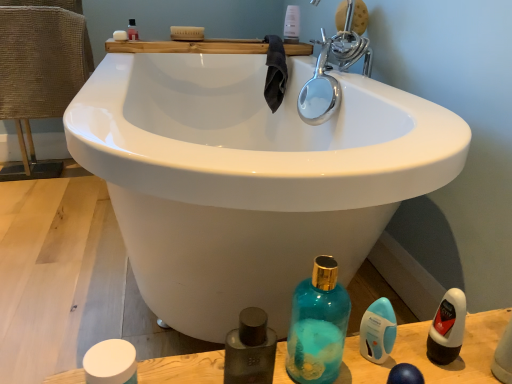
Question: Is white matte jar at lower left, placed as the third mouthwash when sorted from back to front, behind translucent plastic bottle at upper center, the 1th toiletry viewed from the top?

Choices:
 (A) yes
 (B) no

Answer: (B)

Question: Can we say white matte jar at lower left, the first mouthwash when ordered from front to back, lies outside translucent plastic bottle at upper center, the 1th toiletry viewed from the top?

Choices:
 (A) yes
 (B) no

Answer: (A)

Question: Is translucent plastic bottle at upper center, the 1th toiletry from the back, completely or partially inside white matte jar at lower left, which is counted as the 2th mouthwash, starting from the left?

Choices:
 (A) no
 (B) yes

Answer: (A)

Question: Is white matte jar at lower left, placed as the third mouthwash when sorted from back to front, to the right of translucent plastic bottle at upper center, the 1th toiletry viewed from the top, from the viewer's perspective?

Choices:
 (A) yes
 (B) no

Answer: (B)

Question: From the image's perspective, is white matte jar at lower left, the 3th mouthwash positioned from the top, on translucent plastic bottle at upper center, the 1th toiletry viewed from the top?

Choices:
 (A) no
 (B) yes

Answer: (A)

Question: Does point (343, 337) appear closer or farther from the camera than point (426, 352)?

Choices:
 (A) farther
 (B) closer

Answer: (A)

Question: Is teal glass bottle at lower center taller or shorter than white matte bottle at lower right, the second mouthwash when ordered from bottom to top?

Choices:
 (A) short
 (B) tall

Answer: (B)

Question: Is teal glass bottle at lower center wider or thinner than white matte bottle at lower right, the second mouthwash when ordered from bottom to top?

Choices:
 (A) thin
 (B) wide

Answer: (B)

Question: Considering the positions of teal glass bottle at lower center and white matte bottle at lower right, which appears as the second mouthwash when viewed from the front, in the image, is teal glass bottle at lower center bigger or smaller than white matte bottle at lower right, which appears as the second mouthwash when viewed from the front,?

Choices:
 (A) big
 (B) small

Answer: (A)

Question: Does point (124, 38) appear closer or farther from the camera than point (304, 372)?

Choices:
 (A) closer
 (B) farther

Answer: (B)

Question: Choose the correct answer: Is white matte soap at upper left inside teal glass bottle at lower center or outside it?

Choices:
 (A) inside
 (B) outside

Answer: (B)

Question: In terms of size, does white matte soap at upper left appear bigger or smaller than teal glass bottle at lower center?

Choices:
 (A) small
 (B) big

Answer: (A)

Question: From the image's perspective, relative to teal glass bottle at lower center, is white matte soap at upper left above or below?

Choices:
 (A) below
 (B) above

Answer: (B)

Question: Choose the correct answer: Is burlap-textured chair at left inside white matte soap at upper left or outside it?

Choices:
 (A) outside
 (B) inside

Answer: (A)

Question: Considering the relative positions of burlap-textured chair at left and white matte soap at upper left in the image provided, is burlap-textured chair at left to the left or to the right of white matte soap at upper left?

Choices:
 (A) right
 (B) left

Answer: (B)